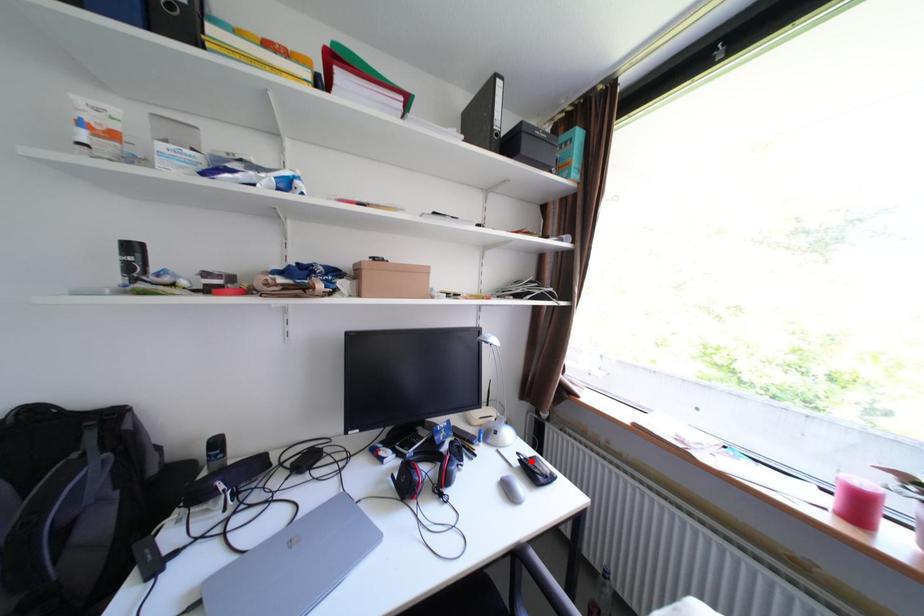
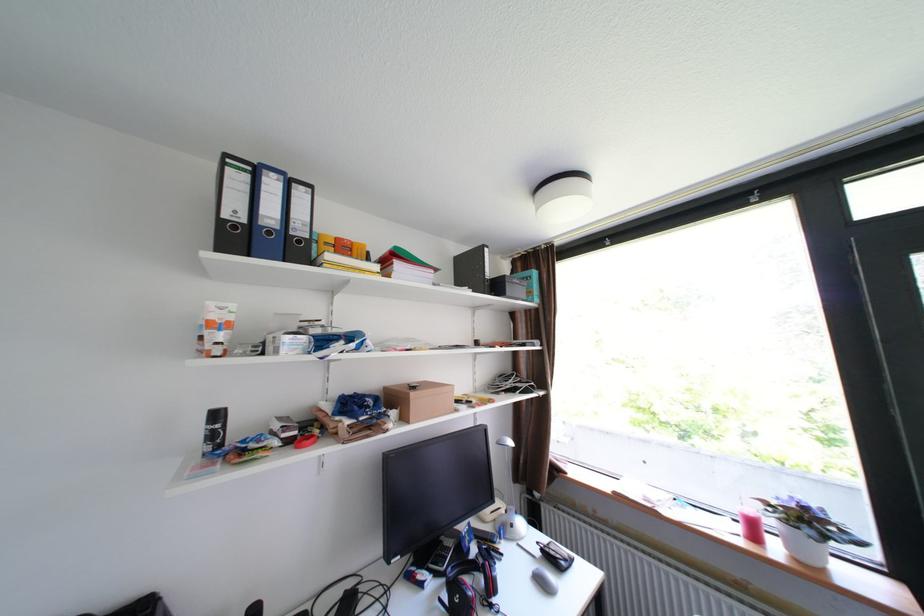
Question: I am providing you with two images of the same scene from different viewpoints. In image1, a red point is highlighted. Considering the same 3D point in image2, which of the following is correct?

Choices:
 (A) It is closer
 (B) It is farther

Answer: (A)